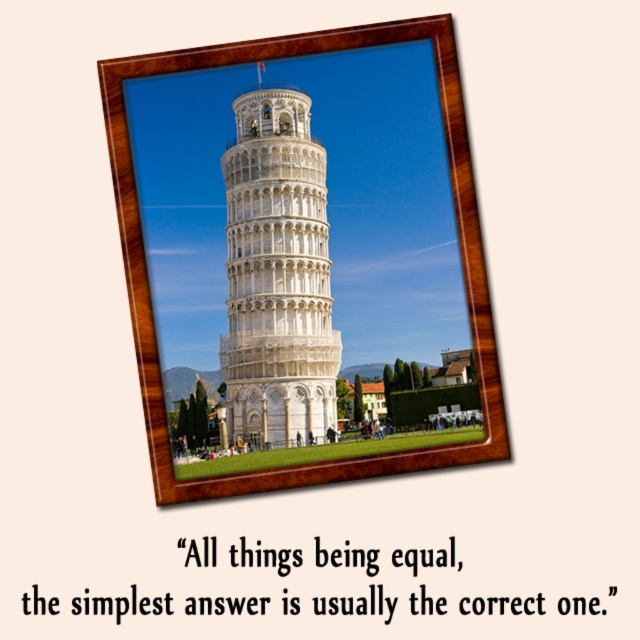
Question: Which object is closer to the camera taking this photo?

Choices:
 (A) wooden frame at center
 (B) white marble tower at center

Answer: (A)

Question: Considering the relative positions of wooden frame at center and white marble tower at center in the image provided, where is wooden frame at center located with respect to white marble tower at center?

Choices:
 (A) right
 (B) left

Answer: (A)

Question: Which point is closer to the camera?

Choices:
 (A) white marble tower at center
 (B) wooden frame at center

Answer: (B)

Question: Is wooden frame at center thinner than white marble tower at center?

Choices:
 (A) no
 (B) yes

Answer: (A)

Question: Is the position of wooden frame at center more distant than that of white marble tower at center?

Choices:
 (A) yes
 (B) no

Answer: (B)